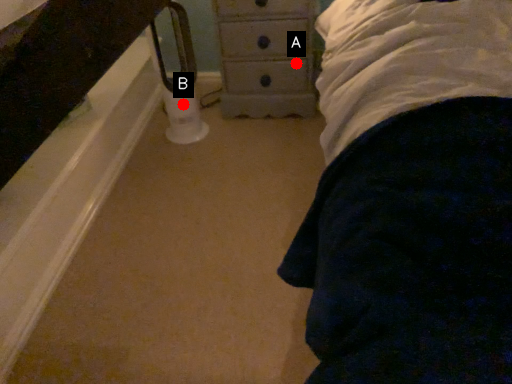
Question: Two points are circled on the image, labeled by A and B beside each circle. Which point is closer to the camera?

Choices:
 (A) A is closer
 (B) B is closer

Answer: (A)